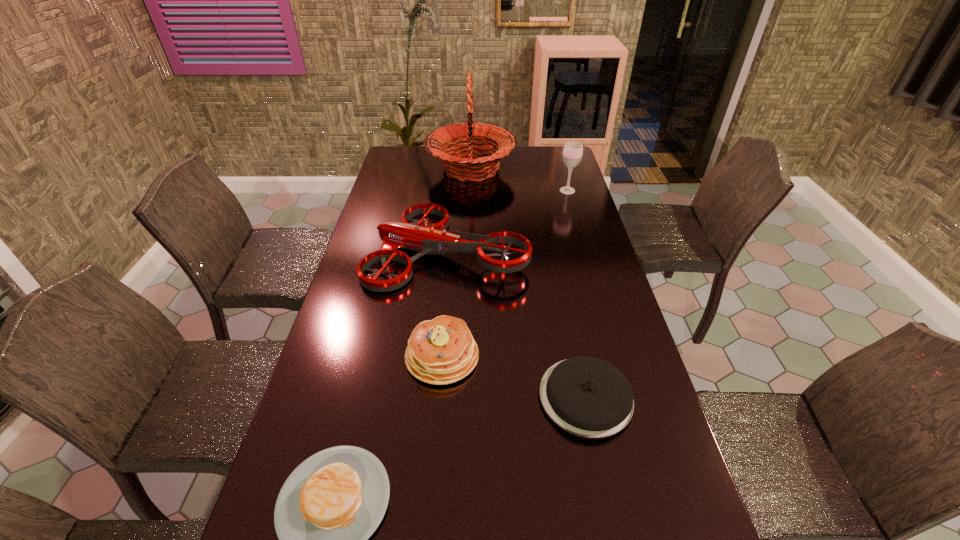
What are the coordinates of `object that is positioned at the far edge` in the screenshot? It's located at (466, 137).

Where is `object that is at the left edge`? object that is at the left edge is located at coordinates (434, 239).

Identify the location of wineglass located at the right edge. (572, 154).

You are a GUI agent. You are given a task and a screenshot of the screen. Output one action in this format:
    pyautogui.click(x=<x>, y=<y>)
    Task: Click on the pancake situated at the right edge
    
    Given the screenshot: What is the action you would take?
    pyautogui.click(x=587, y=397)

Image resolution: width=960 pixels, height=540 pixels. I want to click on free space at the far edge, so click(515, 156).

Locate an element on the screen. The width and height of the screenshot is (960, 540). vacant space at the left edge of the desktop is located at coordinates (355, 325).

This screenshot has height=540, width=960. I want to click on vacant area at the right edge of the desktop, so click(645, 497).

The image size is (960, 540). In the image, there is a desktop. In order to click on free space at the far left corner in this screenshot , I will do `click(397, 156)`.

I want to click on free space at the far right corner of the desktop, so click(537, 150).

Locate an element on the screen. vacant space that's between the fifth shortest object and the basket is located at coordinates (519, 180).